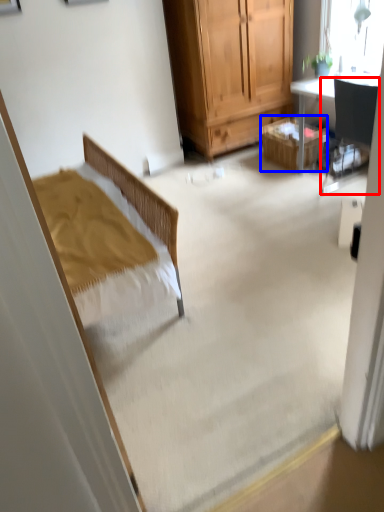
Question: Which point is closer to the camera, chair (highlighted by a red box) or picnic basket (highlighted by a blue box)?

Choices:
 (A) chair
 (B) picnic basket

Answer: (A)